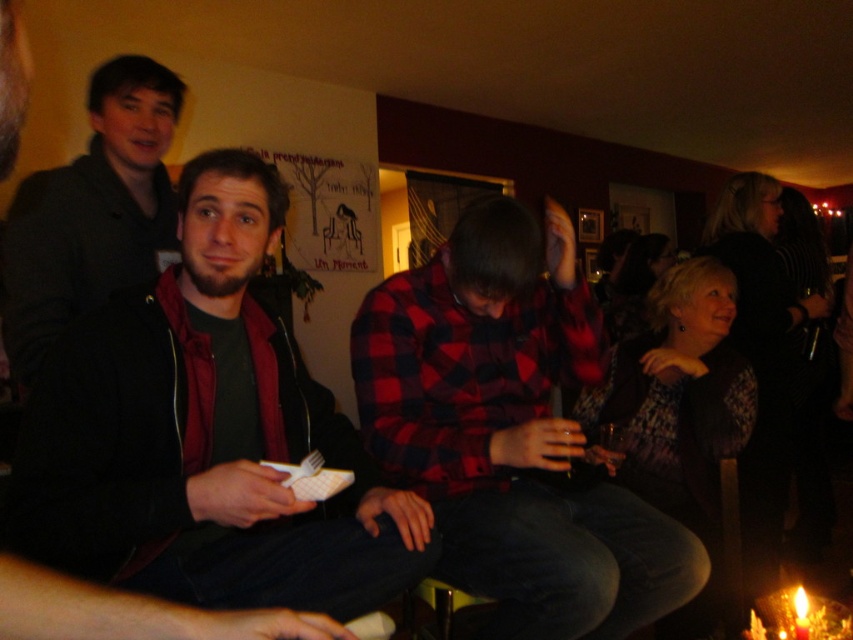
You are a photographer at the event and want to ensure both the matte black jacket at center and the red plaid shirt at center are clearly visible in your photo. Given their sizes, which one might you need to position closer to the camera to ensure both appear equally prominent?

The matte black jacket at center is larger than the red plaid shirt at center. To make both appear equally prominent in the photo, you should position the red plaid shirt at center closer to the camera since it is smaller in size.

Looking at this image, you are at a party and want to greet someone. You see the matte black jacket at center and the red plaid shirt at center. Which one should you approach first if you want to greet the person who is closer to the entrance?

The matte black jacket at center is in front of the red plaid shirt at center, so you should approach the matte black jacket at center first since it is closer to the entrance.

Based on the coordinates provided, which object is located at point (206, 435) in the image?

The point (206, 435) indicates the location of the matte black jacket at center.